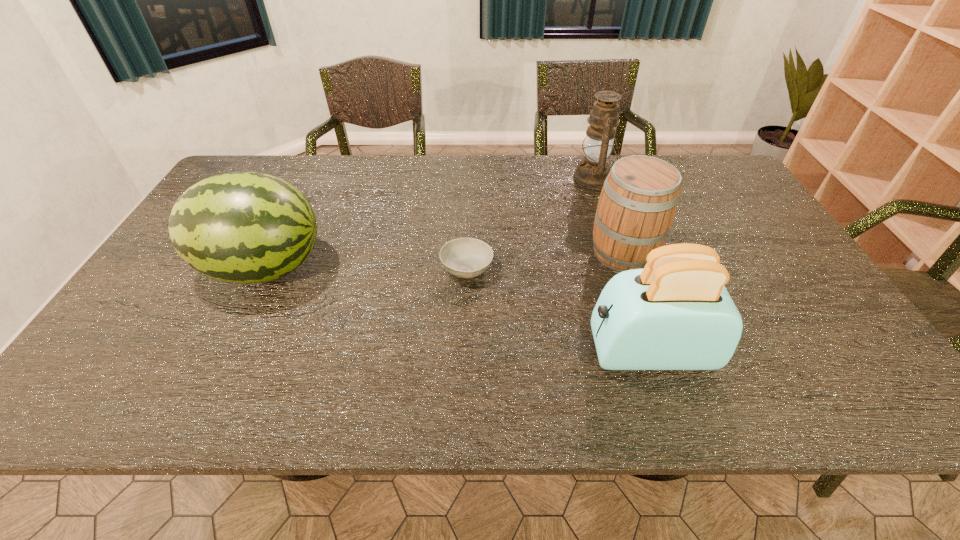
Locate an element on the screen. empty space that is in between the cider and the second object from left to right is located at coordinates (545, 261).

At what (x,y) coordinates should I click in order to perform the action: click on free space between the farthest object and the watermelon. Please return your answer as a coordinate pair (x, y). Looking at the image, I should click on (429, 222).

The width and height of the screenshot is (960, 540). Find the location of `free space between the oil lamp and the watermelon`. free space between the oil lamp and the watermelon is located at coordinates (429, 222).

What are the coordinates of `empty space that is in between the oil lamp and the leftmost object` in the screenshot? It's located at (429, 222).

At what (x,y) coordinates should I click in order to perform the action: click on free space between the watermelon and the fourth object from right to left. Please return your answer as a coordinate pair (x, y). Looking at the image, I should click on (366, 268).

I want to click on vacant point located between the nearest object and the fourth object from right to left, so click(558, 310).

Identify the location of object that is the fourth closest to the toaster. (241, 227).

Identify which object is located as the second nearest to the farthest object. Please provide its 2D coordinates. Your answer should be formatted as a tuple, i.e. [(x, y)], where the tuple contains the x and y coordinates of a point satisfying the conditions above.

[(463, 257)]

At what (x,y) coordinates should I click in order to perform the action: click on vacant space that satisfies the following two spatial constraints: 1. at the stem end of the leftmost object; 2. on the right side of the shortest object. Please return your answer as a coordinate pair (x, y). Looking at the image, I should click on (264, 269).

I want to click on free spot that satisfies the following two spatial constraints: 1. at the stem end of the watermelon; 2. on the back side of the shortest object, so click(x=264, y=269).